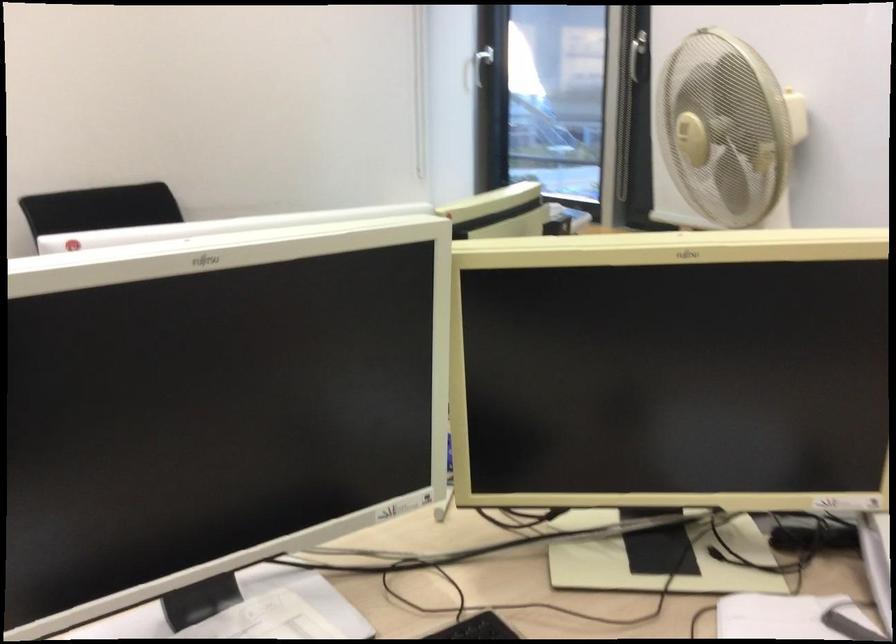
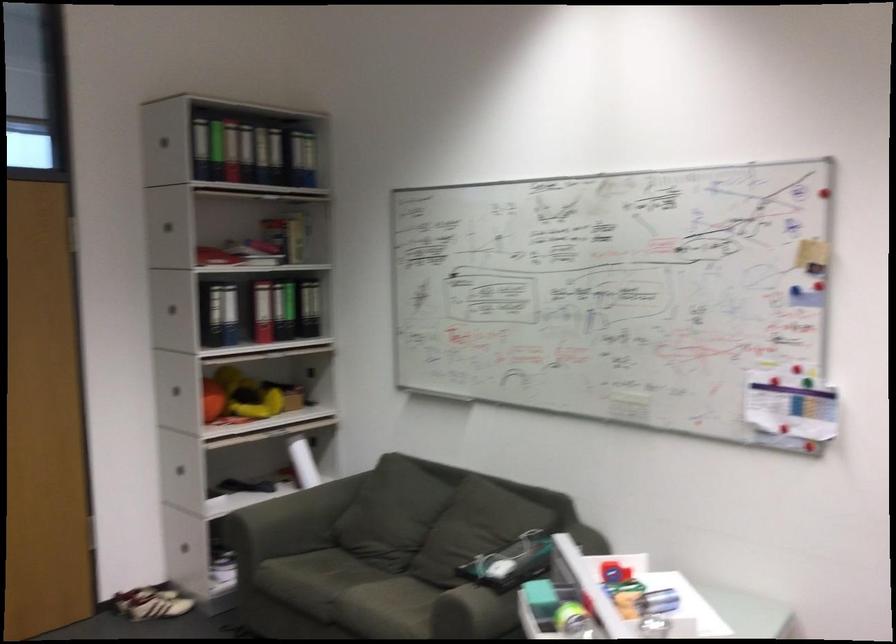
Question: The camera is either moving clockwise (left) or counter-clockwise (right) around the object. The first image is from the beginning of the video and the second image is from the end. Is the camera moving left or right when shooting the video?

Choices:
 (A) Left
 (B) Right

Answer: (B)